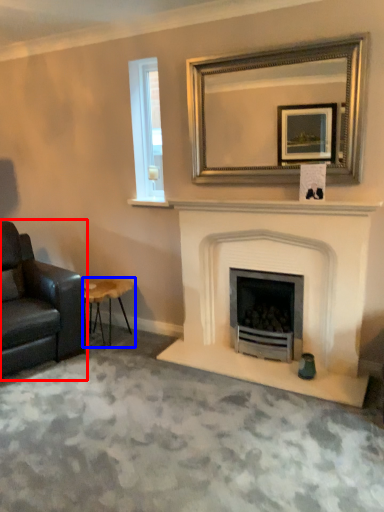
Question: Which of the following is the closest to the observer, chair (highlighted by a red box) or stool (highlighted by a blue box)?

Choices:
 (A) chair
 (B) stool

Answer: (A)